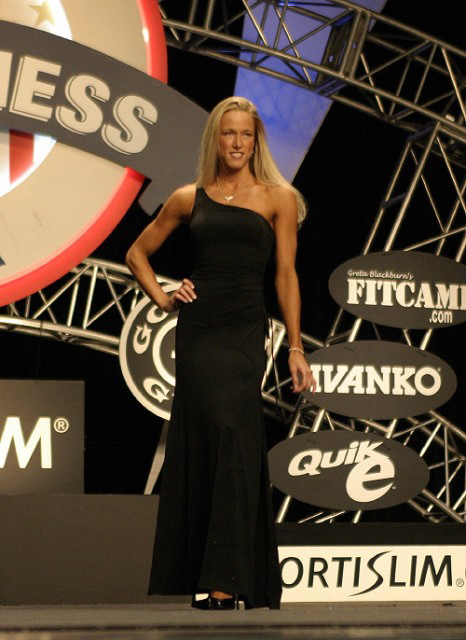
The width and height of the screenshot is (466, 640). I want to click on floor, so click(x=166, y=621).